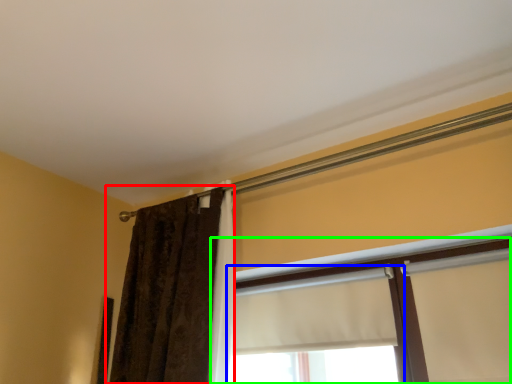
Question: Which object is positioned closest to curtain (highlighted by a red box)? Select from window (highlighted by a blue box) and window (highlighted by a green box).

Choices:
 (A) window
 (B) window

Answer: (A)